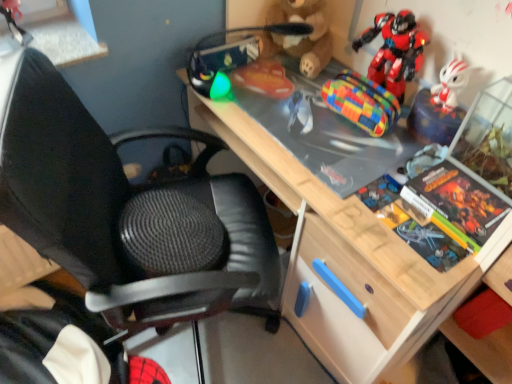
Identify the location of free space above hardcover book at right (from a real-world perspective). This screenshot has height=384, width=512. (458, 198).